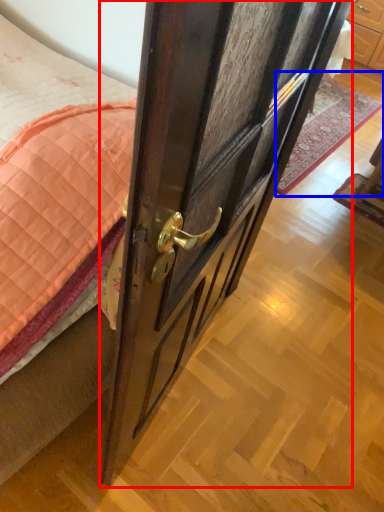
Question: Which of the following is the farthest to the observer, door (highlighted by a red box) or plain (highlighted by a blue box)?

Choices:
 (A) door
 (B) plain

Answer: (B)